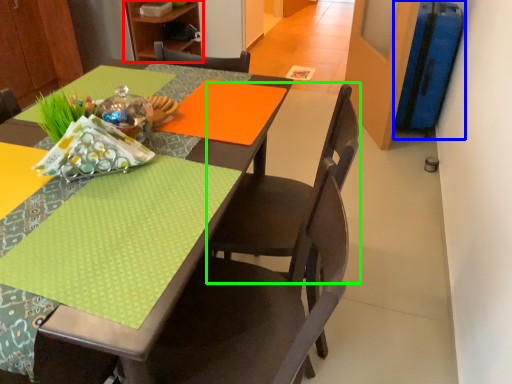
Question: Which is nearer to the bookshelf (highlighted by a red box)? luggage (highlighted by a blue box) or chair (highlighted by a green box).

Choices:
 (A) luggage
 (B) chair

Answer: (A)